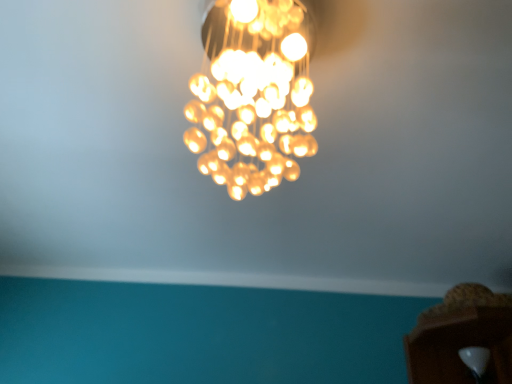
What do you see at coordinates (254, 94) in the screenshot? Image resolution: width=512 pixels, height=384 pixels. I see `matte glass chandelier at center` at bounding box center [254, 94].

Find the location of a particular element. This screenshot has width=512, height=384. matte glass chandelier at center is located at coordinates click(254, 94).

What are the coordinates of `matte glass chandelier at center` in the screenshot? It's located at (254, 94).